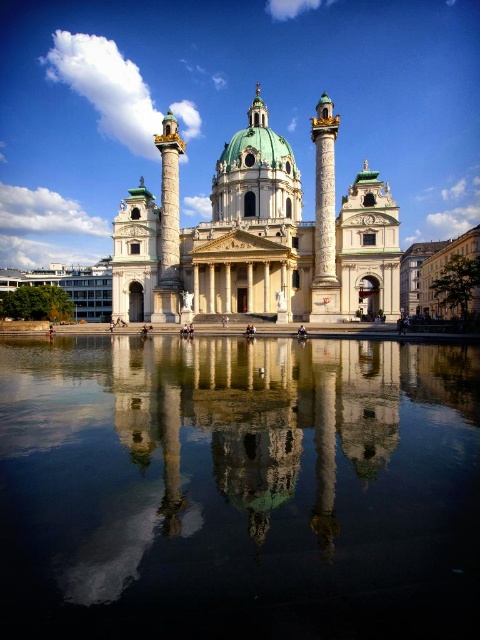
Question: Is gold-carved column at center wider than gold polished column at center?

Choices:
 (A) no
 (B) yes

Answer: (A)

Question: Observing the image, what is the correct spatial positioning of transparent glass water at center in reference to white marble church at center?

Choices:
 (A) below
 (B) above

Answer: (A)

Question: From the image, what is the correct spatial relationship of gold-carved column at center in relation to gold polished column at center?

Choices:
 (A) below
 (B) above

Answer: (A)

Question: Among these points, which one is farthest from the camera?

Choices:
 (A) (168, 180)
 (B) (271, 136)
 (C) (324, 173)
 (D) (312, 346)

Answer: (B)

Question: Which point is closer to the camera taking this photo?

Choices:
 (A) (168, 308)
 (B) (171, 204)

Answer: (A)

Question: Which object is closer to the camera taking this photo?

Choices:
 (A) transparent glass water at center
 (B) gold polished column at center
 (C) white marble church at center
 (D) gold-carved column at center

Answer: (A)